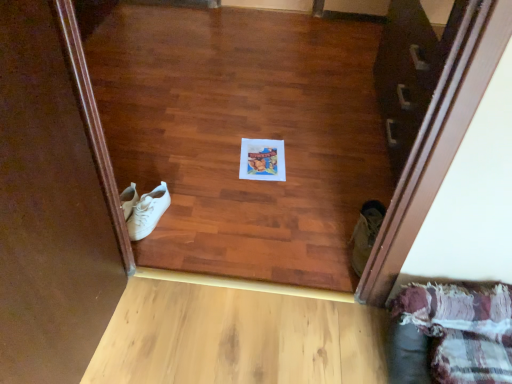
Where is `free spot above light wood plank at lower center (from a real-world perspective)`? The height and width of the screenshot is (384, 512). free spot above light wood plank at lower center (from a real-world perspective) is located at coordinates (210, 337).